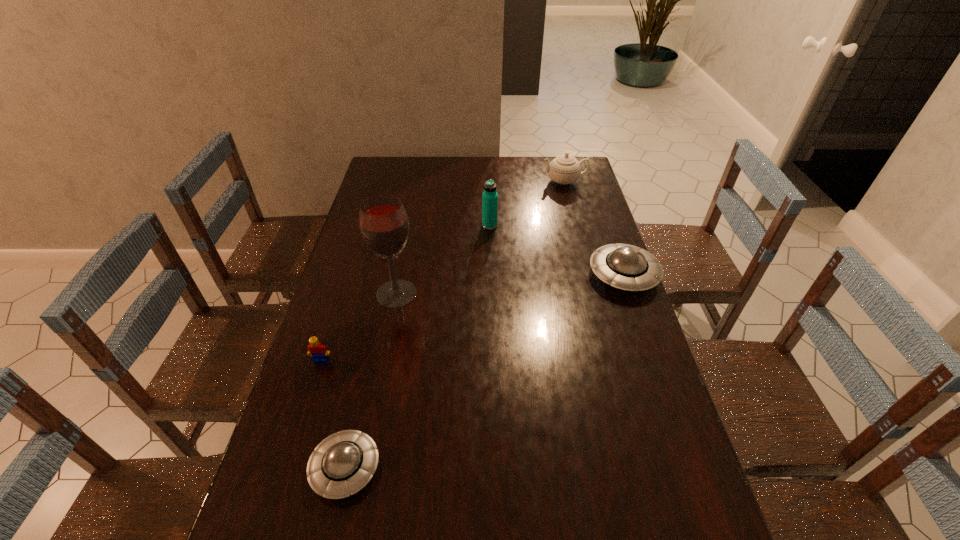
Where is `free space at the left edge of the desktop`? The width and height of the screenshot is (960, 540). free space at the left edge of the desktop is located at coordinates (351, 251).

This screenshot has width=960, height=540. I want to click on vacant region at the right edge of the desktop, so click(x=587, y=186).

The height and width of the screenshot is (540, 960). What are the coordinates of `vacant region at the far left corner` in the screenshot? It's located at (386, 183).

Find the location of a particular element. vacant area that lies between the Lego and the tallest object is located at coordinates (359, 327).

At what (x,y) coordinates should I click in order to perform the action: click on free point between the shortest object and the leftmost object. Please return your answer as a coordinate pair (x, y). The height and width of the screenshot is (540, 960). Looking at the image, I should click on (333, 414).

The image size is (960, 540). I want to click on free spot between the alcohol and the chinaware, so click(480, 238).

Find the location of a particular element. This screenshot has width=960, height=540. free space that is in between the second tallest object and the alcohol is located at coordinates (444, 260).

Where is `vacant space that's between the shorter saucer and the fourth object from left to right`? vacant space that's between the shorter saucer and the fourth object from left to right is located at coordinates (418, 347).

Locate an element on the screen. This screenshot has height=540, width=960. free space that is in between the Lego and the farthest object is located at coordinates (443, 271).

Locate an element on the screen. vacant space in between the third object from right to left and the farthest object is located at coordinates (527, 204).